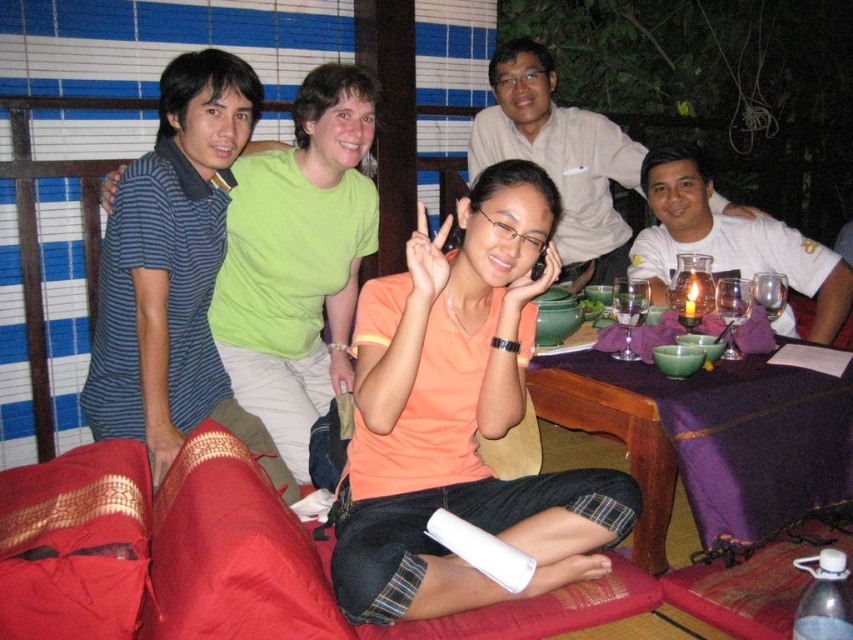
You are a photographer trying to capture a group photo of the blue striped polo shirt at left and the white cotton shirt at upper center. Which one should you focus on first if you want to ensure both are in focus?

The blue striped polo shirt at left is taller than the white cotton shirt at upper center, so focusing on the taller one first would ensure both are in focus.

You are a photographer standing 2 meters away from the group. You want to take a picture of the blue striped polo shirt at left and the white cotton shirt at upper center. Can you fit both in your camera frame if your camera has a 1.5 meter wide field of view?

The blue striped polo shirt at left is 1.39 meters away from the white cotton shirt at upper center. Since the distance between them is less than the camera frame width of 1.5 meters, both can be captured in the same frame.

Consider the image. You are a photographer trying to capture a group photo of the orange matte shirt at center and the white cotton shirt at upper center. Since you want both subjects to appear equally sized in the photo, which one should you move closer to the camera?

You should move closer to the orange matte shirt at center because it is much taller than the white cotton shirt at upper center. By moving closer to the taller subject, you can reduce its apparent size in the photo, making both subjects appear equally sized.